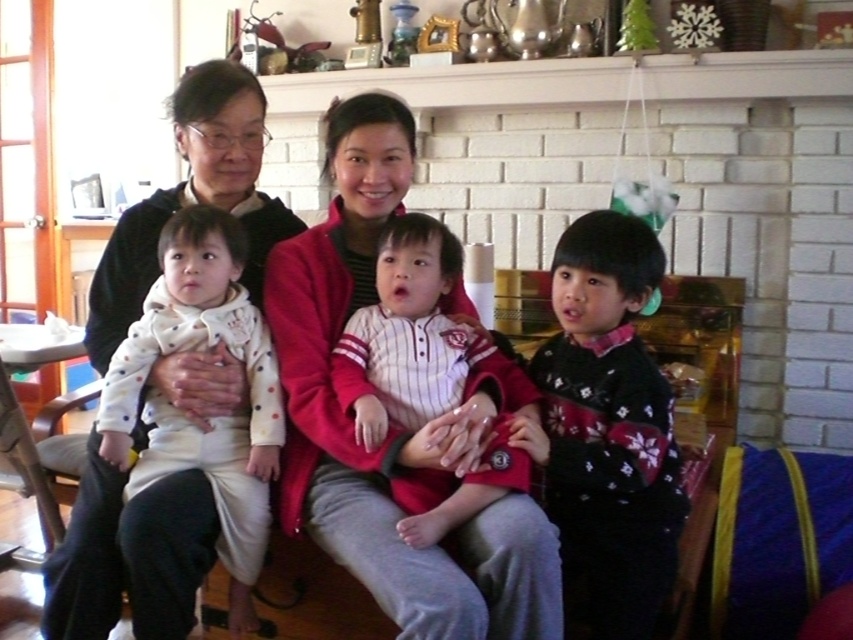
Question: Among these objects, which one is farthest from the camera?

Choices:
 (A) matte red sweater at center
 (B) knitted sweater at right
 (C) white dotted fabric baby at left
 (D) white striped fabric baby at center

Answer: (C)

Question: Is knitted sweater at right further to the viewer compared to white striped fabric baby at center?

Choices:
 (A) yes
 (B) no

Answer: (A)

Question: Which of these objects is positioned closest to the white striped fabric baby at center?

Choices:
 (A) matte white sweater at center
 (B) matte red sweater at center
 (C) white dotted fabric baby at left

Answer: (B)

Question: Among these objects, which one is farthest from the camera?

Choices:
 (A) matte white sweater at center
 (B) white dotted fabric baby at left
 (C) white striped fabric baby at center
 (D) matte red sweater at center

Answer: (B)

Question: Does matte red sweater at center appear under white dotted fabric baby at left?

Choices:
 (A) yes
 (B) no

Answer: (B)

Question: Can you confirm if matte white sweater at center is positioned below white dotted fabric baby at left?

Choices:
 (A) yes
 (B) no

Answer: (B)